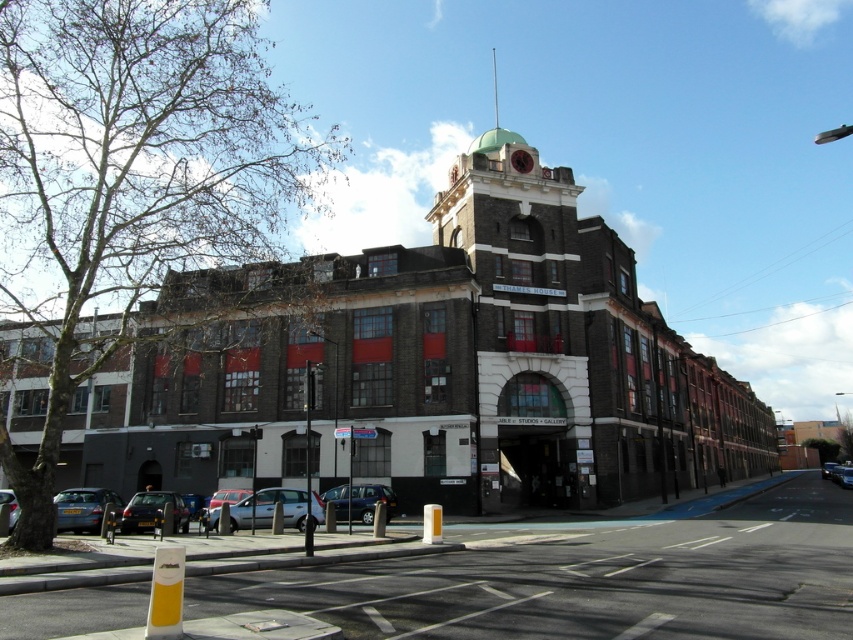
Question: Which of the following is the closest to the observer?

Choices:
 (A) metallic silver car at center
 (B) silver metallic car at lower left
 (C) black matte car at lower left
 (D) matte black car at lower center

Answer: (D)

Question: Does metallic silver van at center appear on the right side of metallic silver car at center?

Choices:
 (A) no
 (B) yes

Answer: (A)

Question: In this image, where is silver metallic car at center located relative to metallic silver car at center?

Choices:
 (A) left
 (B) right

Answer: (A)

Question: Which point is farther to the camera?

Choices:
 (A) (175, 506)
 (B) (592, 444)
 (C) (822, 464)
 (D) (15, 598)

Answer: (C)

Question: Does metallic blue car at lower left have a smaller size compared to metallic silver car at lower left?

Choices:
 (A) yes
 (B) no

Answer: (B)

Question: Estimate the real-world distances between objects in this image. Which object is closer to the silver metallic car at lower left?

Choices:
 (A) metallic silver car at lower left
 (B) black matte car at lower left

Answer: (B)